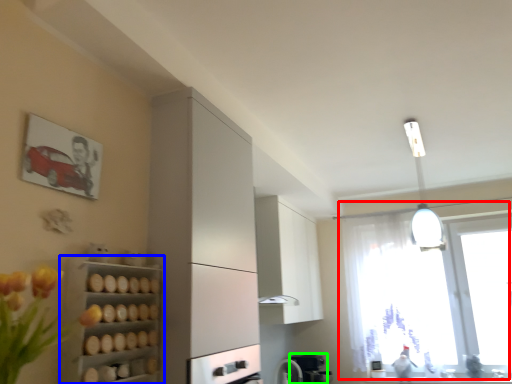
Question: Based on their relative distances, which object is farther from window (highlighted by a red box)? Choose from shelf (highlighted by a blue box) and coffee machine (highlighted by a green box).

Choices:
 (A) shelf
 (B) coffee machine

Answer: (A)